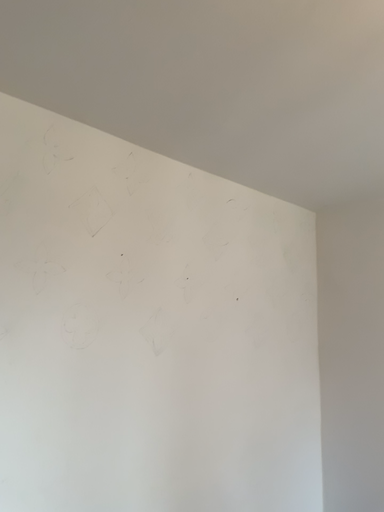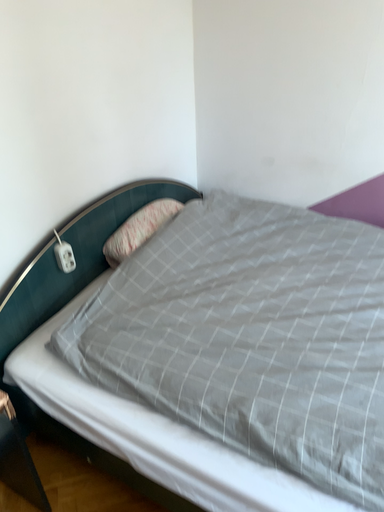
Question: Which way did the camera rotate in the video?

Choices:
 (A) rotated left
 (B) rotated right

Answer: (B)